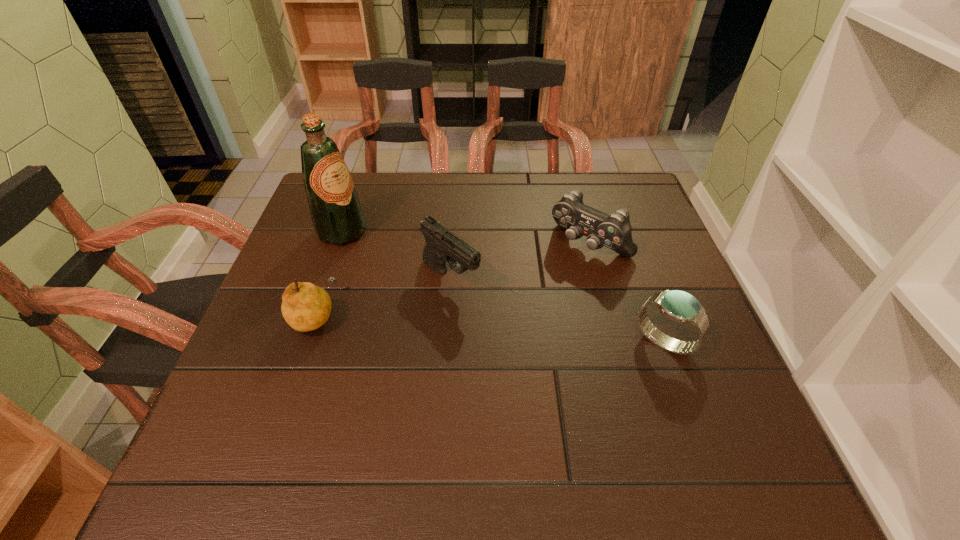
I want to click on vacant space in between the pear and the olive oil, so click(328, 274).

Locate an element on the screen. This screenshot has width=960, height=540. free space between the control and the third object from left to right is located at coordinates (520, 261).

The width and height of the screenshot is (960, 540). Identify the location of free space that is in between the pear and the olive oil. (328, 274).

Find the location of a particular element. The height and width of the screenshot is (540, 960). blank region between the pear and the olive oil is located at coordinates (328, 274).

This screenshot has width=960, height=540. In order to click on vacant region between the watch and the pear in this screenshot , I will do `click(489, 329)`.

The height and width of the screenshot is (540, 960). I want to click on vacant area between the pear and the pistol, so click(383, 297).

Where is `vacant point located between the control and the third object from right to left`? The height and width of the screenshot is (540, 960). vacant point located between the control and the third object from right to left is located at coordinates (520, 261).

This screenshot has height=540, width=960. In order to click on vacant point located between the watch and the tallest object in this screenshot , I will do `click(503, 287)`.

Identify which object is the fourth nearest to the tallest object. Please provide its 2D coordinates. Your answer should be formatted as a tuple, i.e. [(x, y)], where the tuple contains the x and y coordinates of a point satisfying the conditions above.

[(679, 306)]

Locate which object ranks fourth in proximity to the pear. Please provide its 2D coordinates. Your answer should be formatted as a tuple, i.e. [(x, y)], where the tuple contains the x and y coordinates of a point satisfying the conditions above.

[(679, 306)]